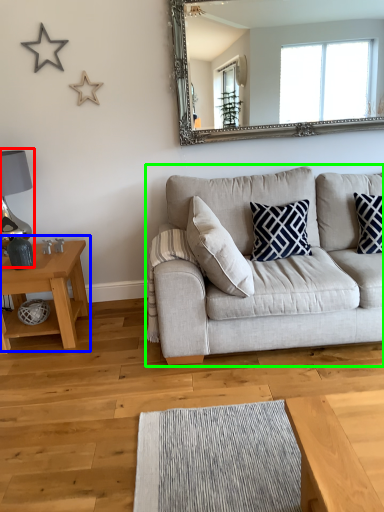
Question: Estimate the real-world distances between objects in this image. Which object is closer to lamp (highlighted by a red box), table (highlighted by a blue box) or studio couch (highlighted by a green box)?

Choices:
 (A) table
 (B) studio couch

Answer: (A)